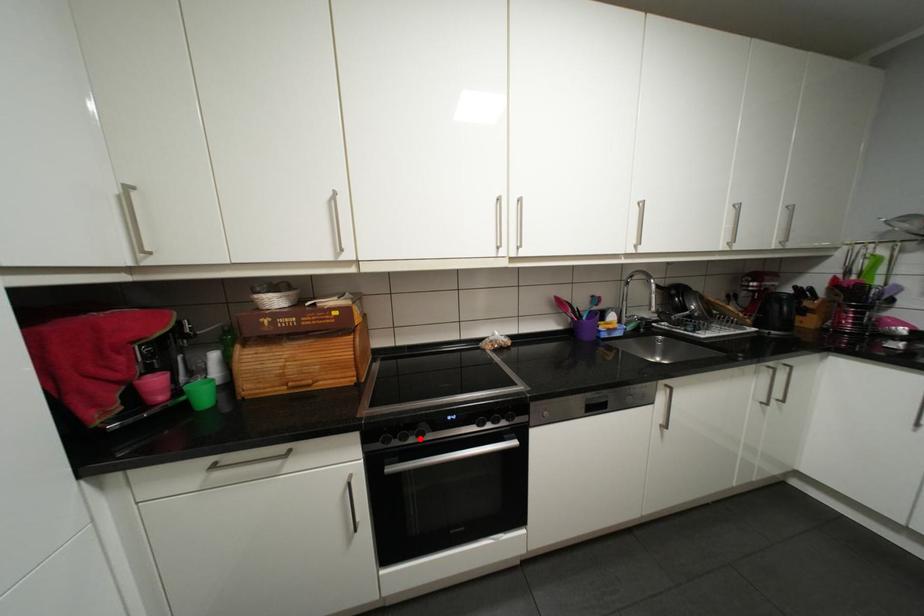
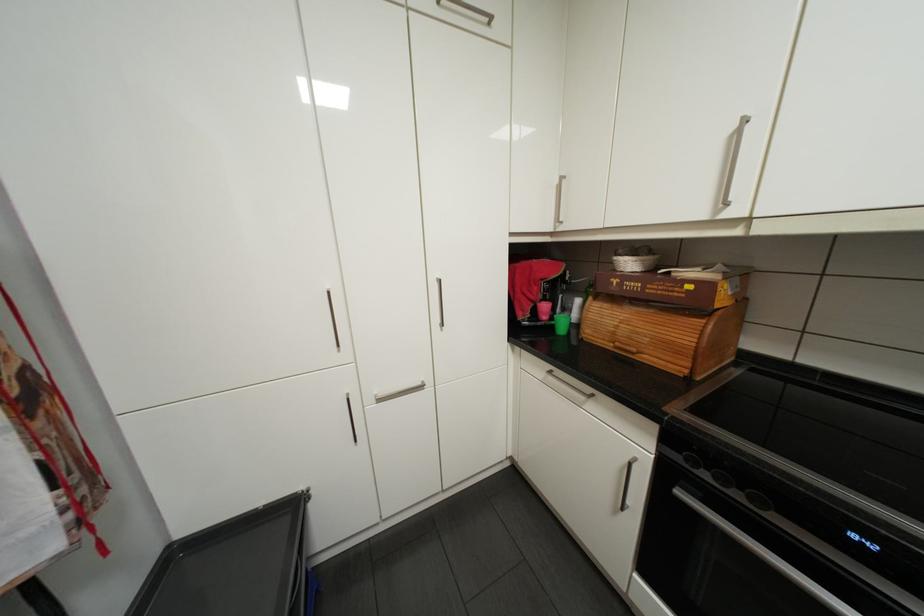
Locate, in the second image, the point that corresponds to the highlighted location in the first image.

(746, 493)